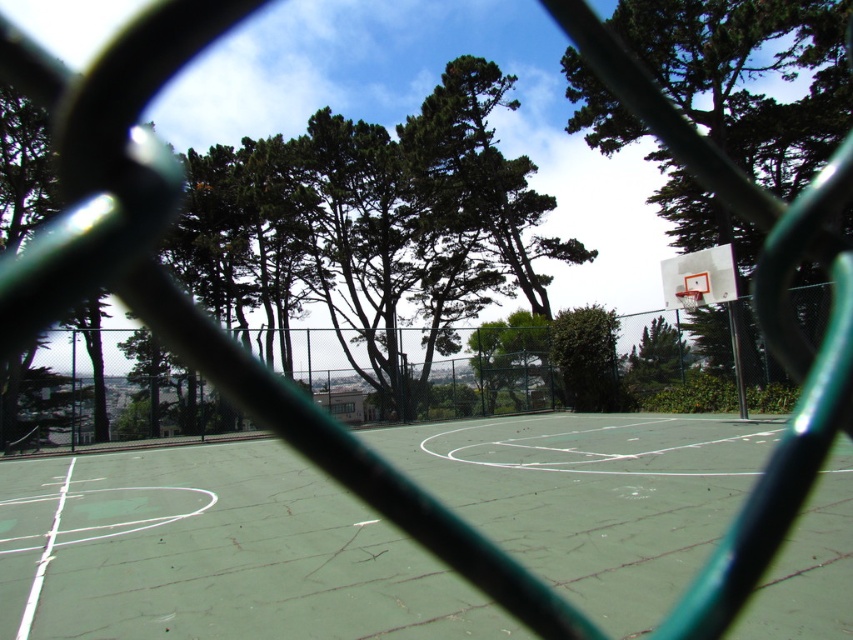
Question: Is green leafy tree at upper right to the right of green leafy tree at center from the viewer's perspective?

Choices:
 (A) yes
 (B) no

Answer: (A)

Question: Observing the image, what is the correct spatial positioning of green leafy tree at upper right in reference to green leafy tree at center?

Choices:
 (A) right
 (B) left

Answer: (A)

Question: Which of these objects is positioned farthest from the green leafy tree at center?

Choices:
 (A) green chain-link fence at center
 (B) green leafy tree at upper right
 (C) green leafy tree at upper center

Answer: (C)

Question: In this image, where is green cracked asphalt basketball court at center located relative to green leafy tree at upper center?

Choices:
 (A) above
 (B) below

Answer: (B)

Question: Which point appears farthest from the camera in this image?

Choices:
 (A) (192, 182)
 (B) (167, 369)
 (C) (109, 582)
 (D) (758, 8)

Answer: (B)

Question: Considering the real-world distances, which object is farthest from the green leafy tree at center?

Choices:
 (A) green cracked asphalt basketball court at center
 (B) green leafy tree at upper right
 (C) green leafy tree at upper center

Answer: (C)